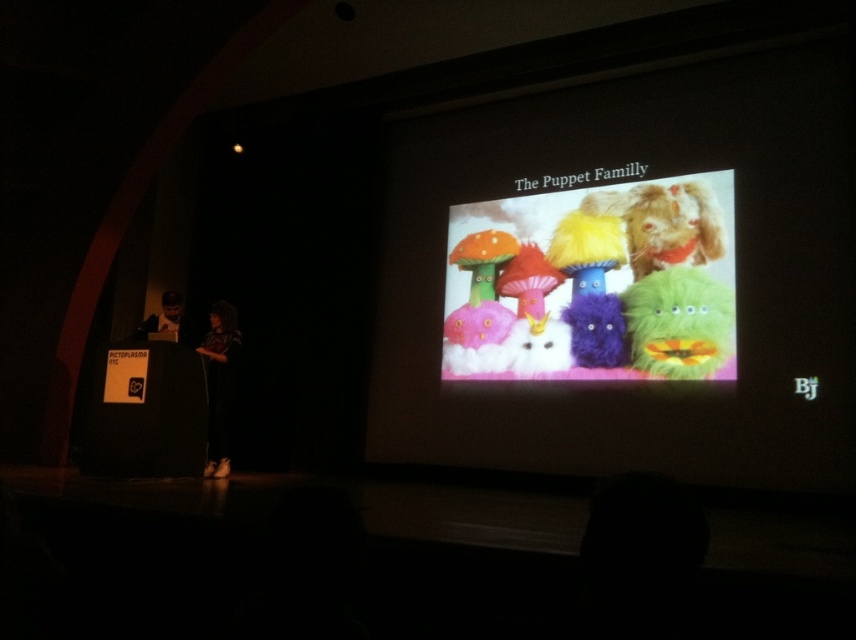
Question: Can you confirm if fluffy green toy at center is wider than matte black laptop at left?

Choices:
 (A) no
 (B) yes

Answer: (B)

Question: Which object is closer to the camera taking this photo?

Choices:
 (A) matte black laptop at left
 (B) fluffy brown dog at upper right

Answer: (A)

Question: Is fluffy green toy at center thinner than fluffy brown dog at upper right?

Choices:
 (A) yes
 (B) no

Answer: (B)

Question: Estimate the real-world distances between objects in this image. Which object is closer to the fuzzy fabric puppets at center?

Choices:
 (A) matte black clothing at center
 (B) matte black laptop at left
 (C) fuzzy plushies at center
 (D) fluffy brown dog at upper right

Answer: (C)

Question: Does matte black clothing at center have a lesser width compared to matte black laptop at left?

Choices:
 (A) no
 (B) yes

Answer: (B)

Question: Which point appears farthest from the camera in this image?

Choices:
 (A) (571, 228)
 (B) (657, 276)
 (C) (229, 362)
 (D) (753, 115)

Answer: (A)